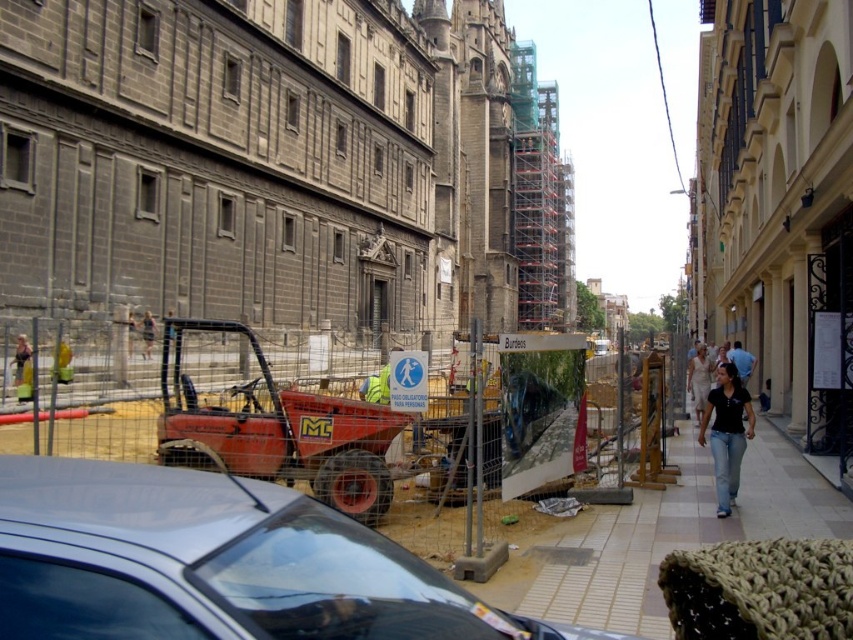
Question: Which object is positioned farthest from the smooth concrete sidewalk at center?

Choices:
 (A) black matte shirt at center
 (B) silver metallic car at center

Answer: (B)

Question: Is smooth concrete sidewalk at center thinner than black matte shirt at center?

Choices:
 (A) no
 (B) yes

Answer: (A)

Question: Which point appears farthest from the camera in this image?

Choices:
 (A) (677, 483)
 (B) (38, 586)

Answer: (A)

Question: Which object is closer to the camera taking this photo?

Choices:
 (A) smooth concrete sidewalk at center
 (B) black matte shirt at center
 (C) silver metallic car at center

Answer: (C)

Question: Does silver metallic car at center appear on the left side of black matte shirt at center?

Choices:
 (A) no
 (B) yes

Answer: (B)

Question: Is silver metallic car at center to the left of black matte shirt at center from the viewer's perspective?

Choices:
 (A) no
 (B) yes

Answer: (B)